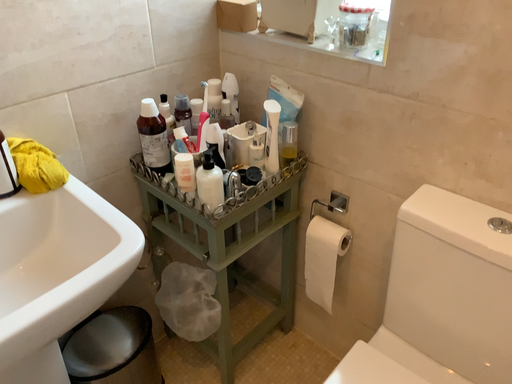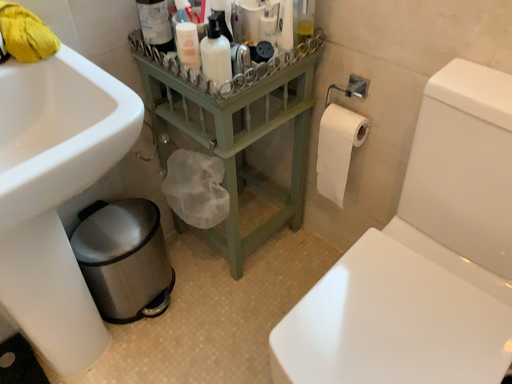
Question: Which way did the camera rotate in the video?

Choices:
 (A) rotated upward
 (B) rotated downward

Answer: (B)